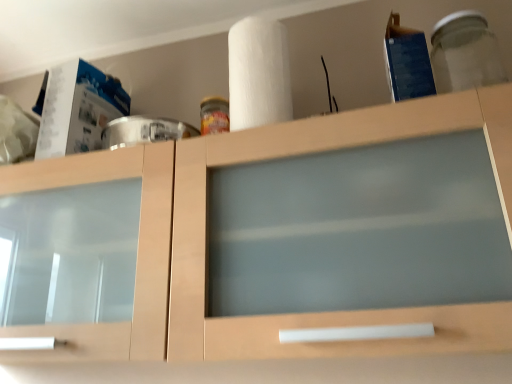
Question: Is transparent glass jar at upper right bigger than white matte paper towel at upper center?

Choices:
 (A) no
 (B) yes

Answer: (A)

Question: Is transparent glass jar at upper right next to white matte paper towel at upper center and touching it?

Choices:
 (A) no
 (B) yes

Answer: (A)

Question: Could you tell me if transparent glass jar at upper right is turned towards white matte paper towel at upper center?

Choices:
 (A) no
 (B) yes

Answer: (A)

Question: Is white matte paper towel at upper center surrounded by transparent glass jar at upper right?

Choices:
 (A) no
 (B) yes

Answer: (A)

Question: Can you confirm if transparent glass jar at upper right is wider than white matte paper towel at upper center?

Choices:
 (A) no
 (B) yes

Answer: (B)

Question: Considering the positions of transparent glass jar at upper right and white matte paper towel at upper center in the image, is transparent glass jar at upper right taller or shorter than white matte paper towel at upper center?

Choices:
 (A) short
 (B) tall

Answer: (A)

Question: Looking at their shapes, would you say transparent glass jar at upper right is wider or thinner than white matte paper towel at upper center?

Choices:
 (A) thin
 (B) wide

Answer: (B)

Question: Is point (495, 51) positioned closer to the camera than point (228, 72)?

Choices:
 (A) farther
 (B) closer

Answer: (B)

Question: Based on their sizes in the image, would you say transparent glass jar at upper right is bigger or smaller than white matte paper towel at upper center?

Choices:
 (A) big
 (B) small

Answer: (B)

Question: From a real-world perspective, relative to transparent glass jar at upper right, is white matte paper towel at upper center vertically above or below?

Choices:
 (A) below
 (B) above

Answer: (B)

Question: In the image, is white matte paper towel at upper center positioned in front of or behind transparent glass jar at upper right?

Choices:
 (A) front
 (B) behind

Answer: (B)

Question: In terms of width, does white matte paper towel at upper center look wider or thinner when compared to transparent glass jar at upper right?

Choices:
 (A) wide
 (B) thin

Answer: (B)

Question: From their relative heights in the image, would you say white matte paper towel at upper center is taller or shorter than transparent glass jar at upper right?

Choices:
 (A) tall
 (B) short

Answer: (A)

Question: Considering the positions of transparent glass jar at upper right and matte wood cabinet at center in the image, is transparent glass jar at upper right taller or shorter than matte wood cabinet at center?

Choices:
 (A) short
 (B) tall

Answer: (A)

Question: From the image's perspective, is transparent glass jar at upper right above or below matte wood cabinet at center?

Choices:
 (A) above
 (B) below

Answer: (A)